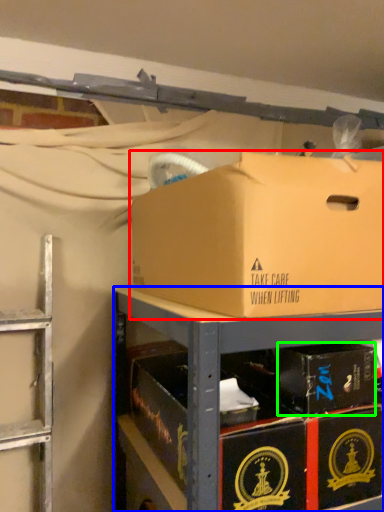
Question: Which object is the closest to the box (highlighted by a red box)? Choose among these: shelf (highlighted by a blue box) or box (highlighted by a green box).

Choices:
 (A) shelf
 (B) box

Answer: (A)